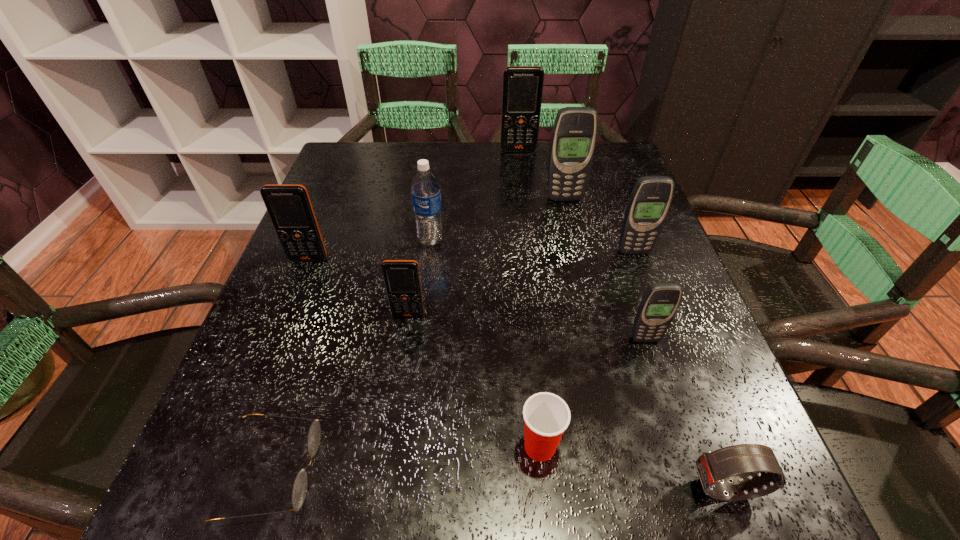
This screenshot has height=540, width=960. In order to click on free space between the nearest gray cellular telephone and the farthest object in this screenshot , I will do `click(582, 245)`.

In order to click on vacant area that lies between the water bottle and the fifth farthest object in this screenshot , I will do (x=370, y=250).

Find the location of a particular element. Image resolution: width=960 pixels, height=540 pixels. empty space that is in between the fourth farthest cellular telephone and the Dixie cup is located at coordinates (424, 353).

The width and height of the screenshot is (960, 540). Identify the location of object that stands as the second closest to the biggest gray cellular telephone. (522, 90).

Where is `object that ranks as the second closest to the Dixie cup`? object that ranks as the second closest to the Dixie cup is located at coordinates (660, 302).

Where is `cellular telephone that is the third closest to the fourth nearest cellular telephone`? cellular telephone that is the third closest to the fourth nearest cellular telephone is located at coordinates (402, 281).

Identify the location of the third closest cellular telephone to the water bottle. (574, 134).

Select which orange cellular telephone appears as the second closest to the fourth nearest cellular telephone. Please provide its 2D coordinates. Your answer should be formatted as a tuple, i.e. [(x, y)], where the tuple contains the x and y coordinates of a point satisfying the conditions above.

[(522, 90)]

Identify the location of orange cellular telephone that is the closest to the ninth nearest object. This screenshot has width=960, height=540. (522, 90).

Locate which gray cellular telephone is the third closest to the second orange cellular telephone from left to right. Please provide its 2D coordinates. Your answer should be formatted as a tuple, i.e. [(x, y)], where the tuple contains the x and y coordinates of a point satisfying the conditions above.

[(574, 134)]